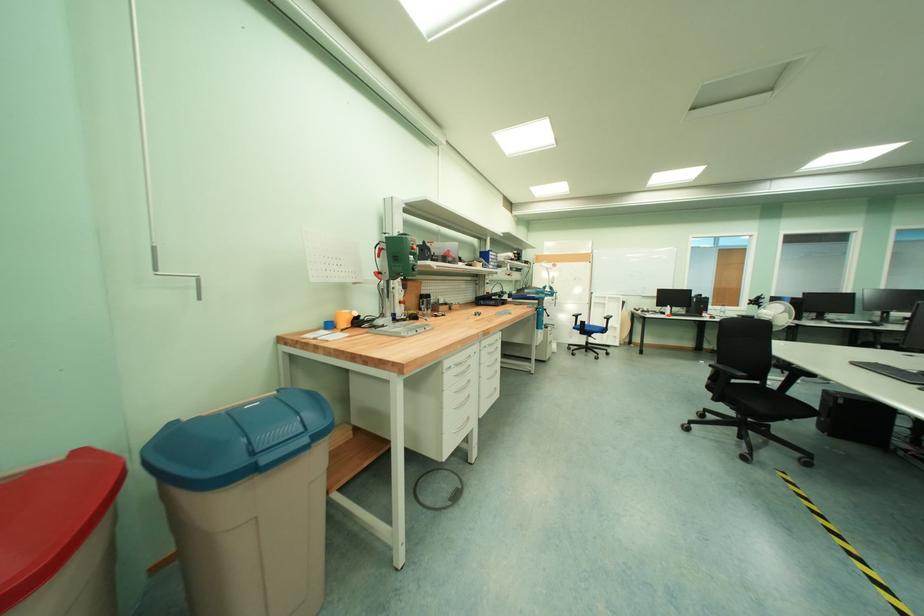
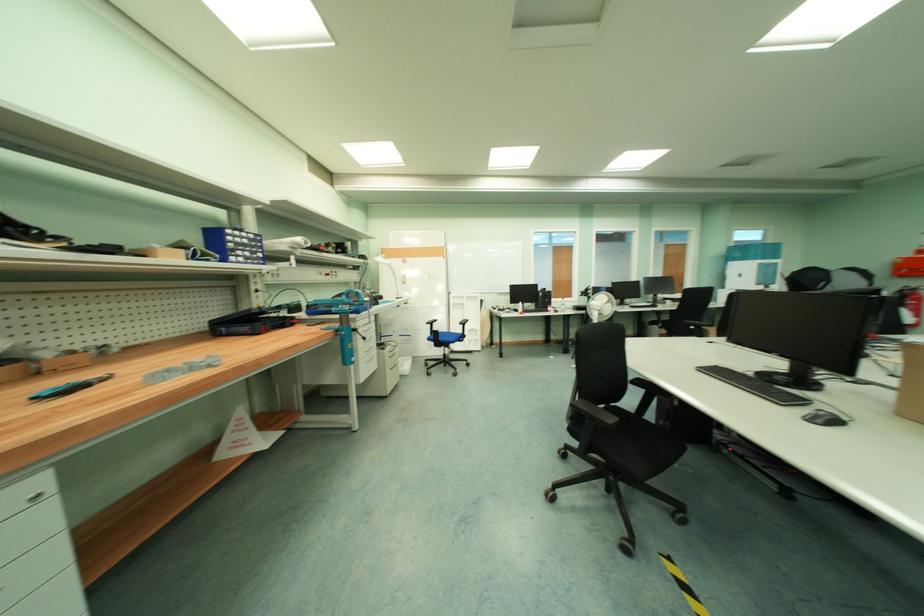
What movement of the cameraman would produce the second image?

The cameraman walked toward right, forward.